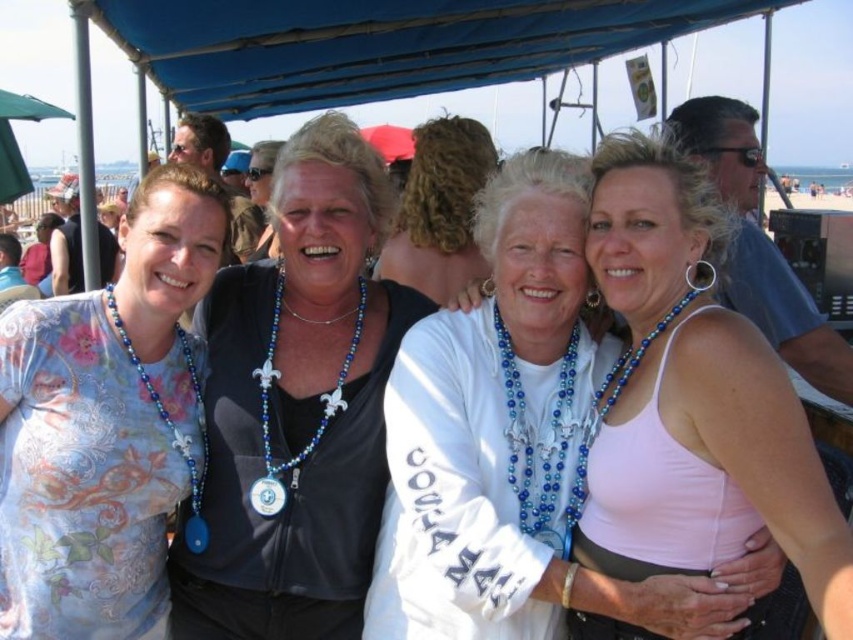
Question: Is pink fabric tank top at center smaller than white matte shirt at center?

Choices:
 (A) no
 (B) yes

Answer: (B)

Question: Considering the relative positions of blue beaded necklace at left and blue beaded necklace at right in the image provided, where is blue beaded necklace at left located with respect to blue beaded necklace at right?

Choices:
 (A) below
 (B) above

Answer: (A)

Question: Which point appears farthest from the camera in this image?

Choices:
 (A) (410, 168)
 (B) (766, 477)

Answer: (A)

Question: Which of the following is the farthest from the observer?

Choices:
 (A) floral printed shirt at left
 (B) pink fabric tank top at center
 (C) blue beaded necklace with white fleur-de-lis pendants at center
 (D) black leather jacket at center

Answer: (C)

Question: Which point is closer to the camera?

Choices:
 (A) (235, 604)
 (B) (146, 378)

Answer: (A)

Question: Is blue fabric canopy at upper center below white fabric at center?

Choices:
 (A) no
 (B) yes

Answer: (A)